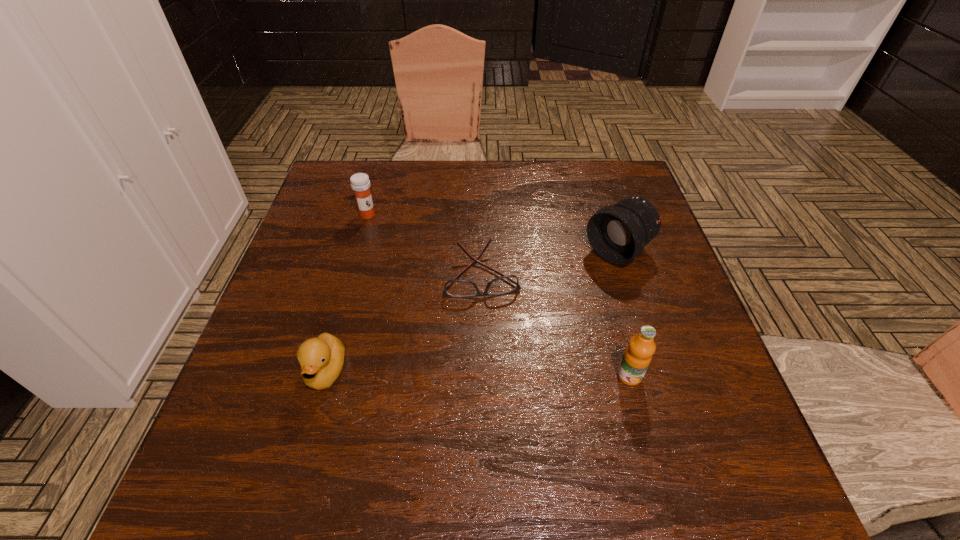
The height and width of the screenshot is (540, 960). I want to click on telephoto lens that is at the right edge, so click(x=618, y=234).

The height and width of the screenshot is (540, 960). In order to click on object that is at the near left corner in this screenshot , I will do `click(321, 359)`.

Identify the location of vacant point at the far edge. This screenshot has height=540, width=960. (487, 181).

Find the location of a particular element. This screenshot has width=960, height=540. free spot at the left edge of the desktop is located at coordinates (273, 322).

Where is `free space at the right edge of the desktop`? This screenshot has width=960, height=540. free space at the right edge of the desktop is located at coordinates (656, 310).

Image resolution: width=960 pixels, height=540 pixels. In order to click on vacant space at the far left corner of the desktop in this screenshot , I will do `click(332, 194)`.

In the image, there is a desktop. Identify the location of free space at the near left corner. The image size is (960, 540). (309, 416).

The height and width of the screenshot is (540, 960). Identify the location of free space at the far right corner of the desktop. (634, 173).

At what (x,y) coordinates should I click in order to perform the action: click on vacant space at the near right corner of the desktop. Please return your answer as a coordinate pair (x, y). This screenshot has width=960, height=540. Looking at the image, I should click on (664, 406).

Locate an element on the screen. Image resolution: width=960 pixels, height=540 pixels. free space between the third object from left to right and the telephoto lens is located at coordinates (550, 262).